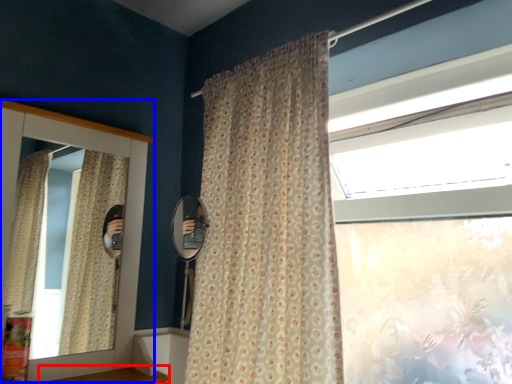
Question: Which object appears closest to the camera in this image, window sill (highlighted by a red box) or medicine cabinet (highlighted by a blue box)?

Choices:
 (A) window sill
 (B) medicine cabinet

Answer: (A)